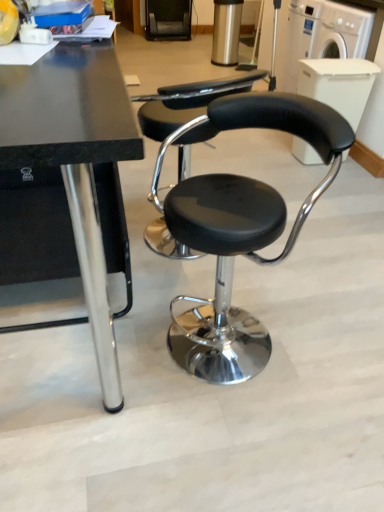
Question: Are white plastic washing machine at upper right, which appears as the second washing machine when ordered from the bottom, and black leather stool at center making contact?

Choices:
 (A) yes
 (B) no

Answer: (B)

Question: Considering the relative sizes of white plastic washing machine at upper right, which appears as the second washing machine when ordered from the bottom, and black leather stool at center in the image provided, is white plastic washing machine at upper right, which appears as the second washing machine when ordered from the bottom, bigger than black leather stool at center?

Choices:
 (A) yes
 (B) no

Answer: (A)

Question: From a real-world perspective, is white plastic washing machine at upper right, which appears as the second washing machine when ordered from the bottom, over black leather stool at center?

Choices:
 (A) yes
 (B) no

Answer: (A)

Question: Could black leather stool at center be considered to be inside white plastic washing machine at upper right, the 1th washing machine when ordered from top to bottom?

Choices:
 (A) yes
 (B) no

Answer: (B)

Question: Considering the relative sizes of white plastic washing machine at upper right, which appears as the second washing machine when ordered from the bottom, and black leather stool at center in the image provided, is white plastic washing machine at upper right, which appears as the second washing machine when ordered from the bottom, shorter than black leather stool at center?

Choices:
 (A) yes
 (B) no

Answer: (B)

Question: Is white plastic washing machine at upper right, the 1th washing machine when ordered from top to bottom, behind black leather stool at center?

Choices:
 (A) yes
 (B) no

Answer: (A)

Question: Is white plastic washing machine at upper right, the 1th washing machine when ordered from top to bottom, bigger than black polished wood table at center?

Choices:
 (A) no
 (B) yes

Answer: (A)

Question: From the image's perspective, does white plastic washing machine at upper right, the 1th washing machine when ordered from top to bottom, appear lower than black polished wood table at center?

Choices:
 (A) no
 (B) yes

Answer: (A)

Question: Is white plastic washing machine at upper right, which appears as the second washing machine when ordered from the bottom, facing towards black polished wood table at center?

Choices:
 (A) no
 (B) yes

Answer: (A)

Question: From a real-world perspective, is white plastic washing machine at upper right, which appears as the second washing machine when ordered from the bottom, over black polished wood table at center?

Choices:
 (A) yes
 (B) no

Answer: (B)

Question: Is white plastic washing machine at upper right, which appears as the second washing machine when ordered from the bottom, shorter than black polished wood table at center?

Choices:
 (A) no
 (B) yes

Answer: (B)

Question: Can black polished wood table at center be found inside white plastic washing machine at upper right, which appears as the second washing machine when ordered from the bottom?

Choices:
 (A) no
 (B) yes

Answer: (A)

Question: Is white plastic washing machine at upper right, which is the 2th washing machine from top to bottom, surrounding white plastic washing machine at upper right, the 1th washing machine when ordered from top to bottom?

Choices:
 (A) no
 (B) yes

Answer: (A)